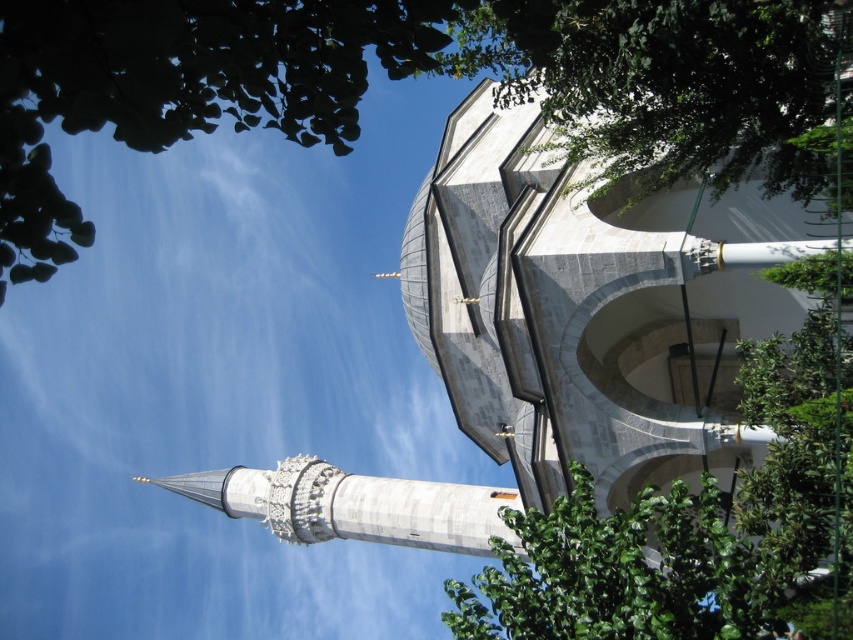
You are standing in front of the mosque and notice two points marked on the minaret. One is at coordinate point (695, 134) and the other at point (648, 548). Which point would appear larger in your view?

Point (695, 134) is closer to the camera than point (648, 548), so it would appear larger in your view.

You are standing at the entrance of the mosque and want to take a photo of the green leafy tree at upper left. Which direction should you face to capture it in your view?

The green leafy tree at upper left is located at point (386, 74), which is in the upper left area of the scene. To capture it, you should face towards the upper left direction from the entrance.

You are a visitor standing in front of the mosque and notice two green leafy trees in the upper part of the view. Which tree is closer to you, the green leafy tree at upper left or the green leafy tree at upper center?

The green leafy tree at upper left is closer to you because it is in front of the green leafy tree at upper center.